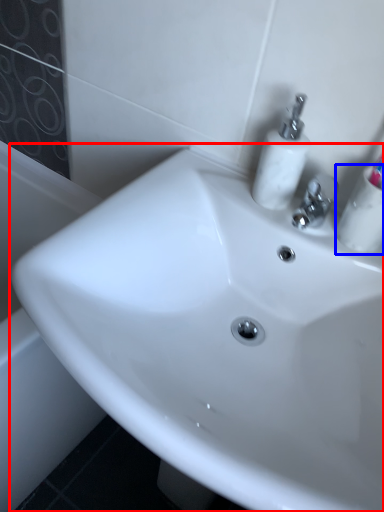
Question: Which object is closer to the camera taking this photo, sink (highlighted by a red box) or mouthwash (highlighted by a blue box)?

Choices:
 (A) sink
 (B) mouthwash

Answer: (A)